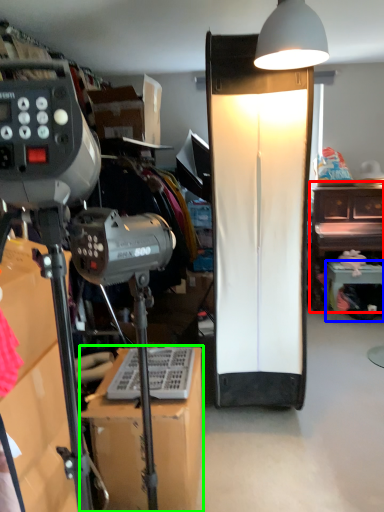
Question: Which object is positioned closest to furniture (highlighted by a red box)? Select from furniture (highlighted by a blue box) and furniture (highlighted by a green box).

Choices:
 (A) furniture
 (B) furniture

Answer: (A)